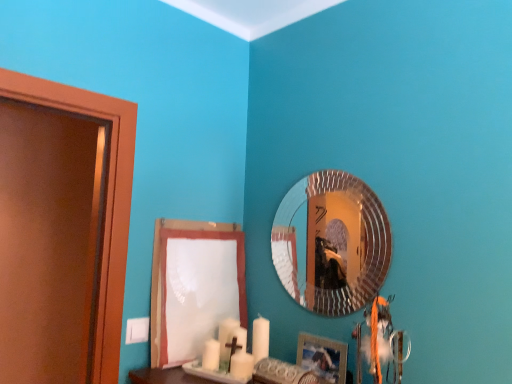
Question: Is silver textured mirror at upper center taller or shorter than wooden picture frame at lower right?

Choices:
 (A) tall
 (B) short

Answer: (A)

Question: Looking at their shapes, would you say silver textured mirror at upper center is wider or thinner than wooden picture frame at lower right?

Choices:
 (A) thin
 (B) wide

Answer: (A)

Question: Which object is positioned farthest from the wooden picture frame at lower right?

Choices:
 (A) white paper at lower center
 (B) silver textured mirror at upper center

Answer: (A)

Question: Based on their relative distances, which object is farther from the wooden picture frame at lower right?

Choices:
 (A) silver textured mirror at upper center
 (B) white paper at lower center

Answer: (B)